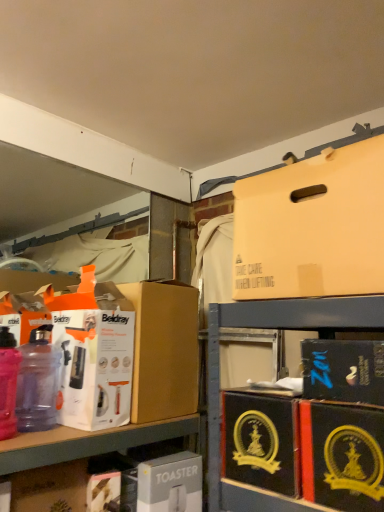
Question: Is translucent plastic bottle at left, acting as the 2th bottle starting from the right, in front of or behind black cardboard box at lower right, the fifth box in the top-to-bottom sequence, in the image?

Choices:
 (A) front
 (B) behind

Answer: (B)

Question: From a real-world perspective, is translucent plastic bottle at left, acting as the 2th bottle starting from the right, positioned above or below black cardboard box at lower right, the fifth box in the top-to-bottom sequence?

Choices:
 (A) below
 (B) above

Answer: (B)

Question: Based on their relative distances, which object is farther from the translucent plastic bottle at left, acting as the 2th bottle starting from the right?

Choices:
 (A) black cardboard box at lower right, which is counted as the 4th box, starting from the top
 (B) transparent plastic bottle at left, which ranks as the 2th bottle in left-to-right order
 (C) brown cardboard box at center, which ranks as the fourth box in bottom-to-top order
 (D) matte cardboard box at lower left
 (E) matte cardboard box at upper right, which is counted as the first box, starting from the top

Answer: (A)

Question: Which object is the farthest from the brown cardboard box at center, which is counted as the third box, starting from the top?

Choices:
 (A) black cardboard box at lower right, the fifth box in the top-to-bottom sequence
 (B) white cardboard toaster at lower center, which ranks as the 6th box in top-to-bottom order
 (C) matte cardboard box at upper right, which is the 6th box from bottom to top
 (D) black cardboard box at lower right, which is counted as the 4th box, starting from the top
 (E) matte black box at lower right, the 2th box positioned from the top

Answer: (D)